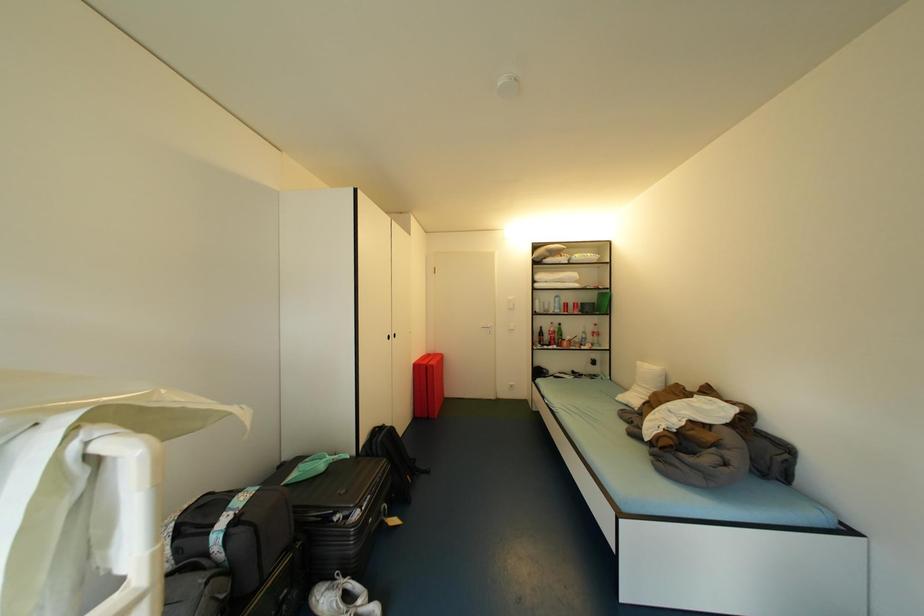
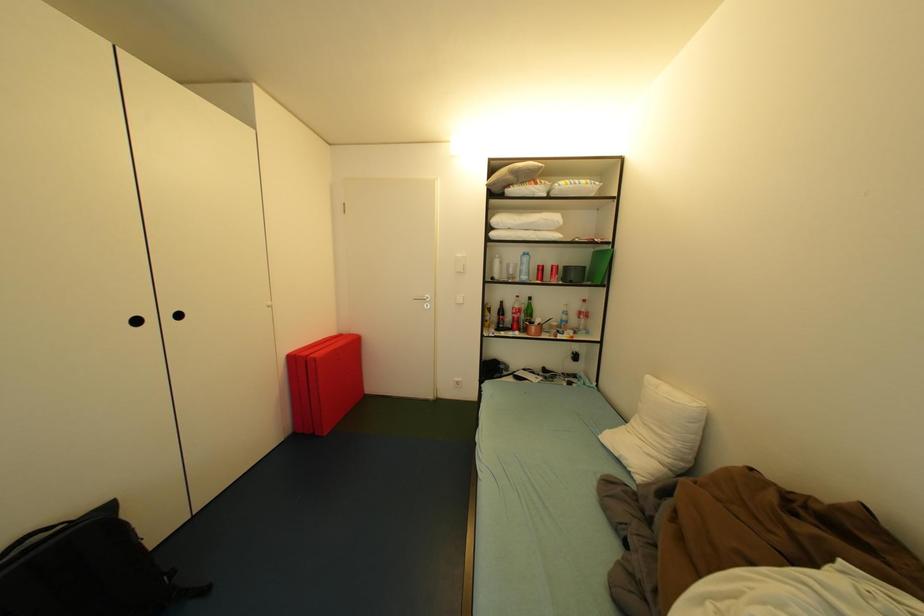
What movement of the cameraman would produce the second image?

The movement direction of the cameraman is right, forward.